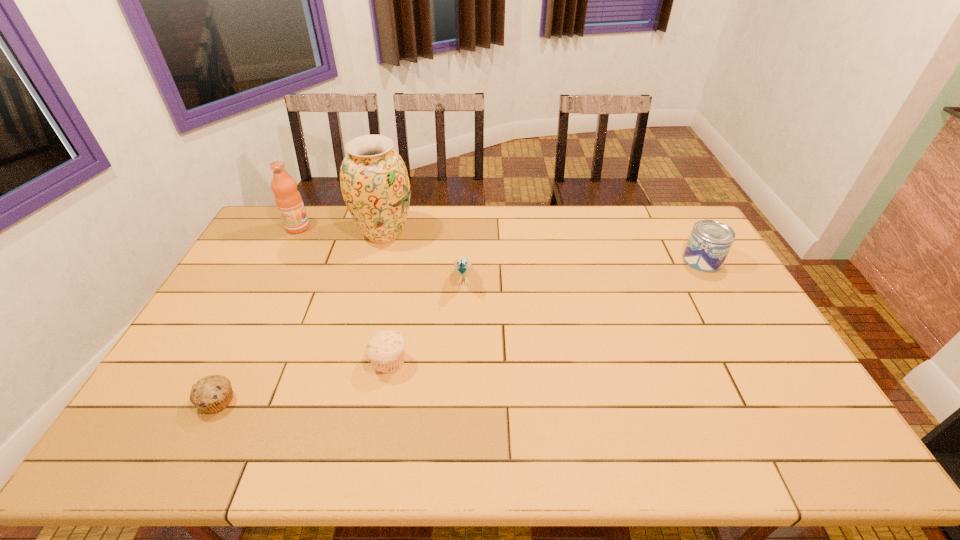
Locate an element on the screen. object at the far left corner is located at coordinates (289, 202).

I want to click on free spot at the far edge of the desktop, so click(328, 239).

Find the location of `vacant region at the left edge`. vacant region at the left edge is located at coordinates (264, 277).

Identify the location of free space at the right edge of the desktop. (743, 344).

Where is `vacant region at the far left corner of the desktop`? vacant region at the far left corner of the desktop is located at coordinates (262, 233).

Identify the location of blank space at the far right corner of the desktop. The image size is (960, 540). (687, 218).

Find the location of a particular element. The image size is (960, 540). empty location between the tallest object and the fifth object from left to right is located at coordinates (424, 255).

Identify the location of empty location between the left muffin and the second tallest object. (257, 314).

The width and height of the screenshot is (960, 540). Find the location of `free space between the rightmost object and the fifth object from left to right`. free space between the rightmost object and the fifth object from left to right is located at coordinates (583, 269).

Image resolution: width=960 pixels, height=540 pixels. I want to click on blank region between the fifth object from left to right and the tallest object, so click(x=424, y=255).